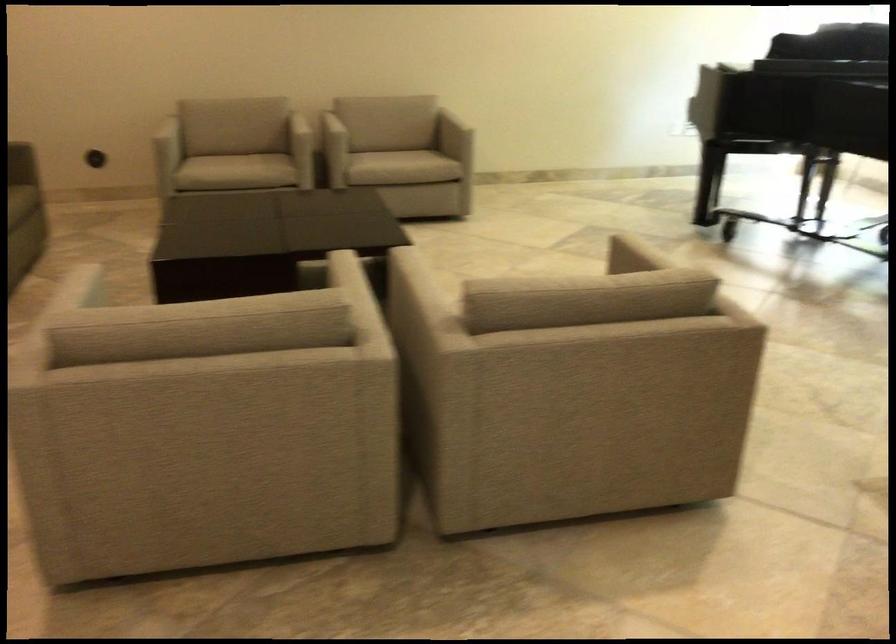
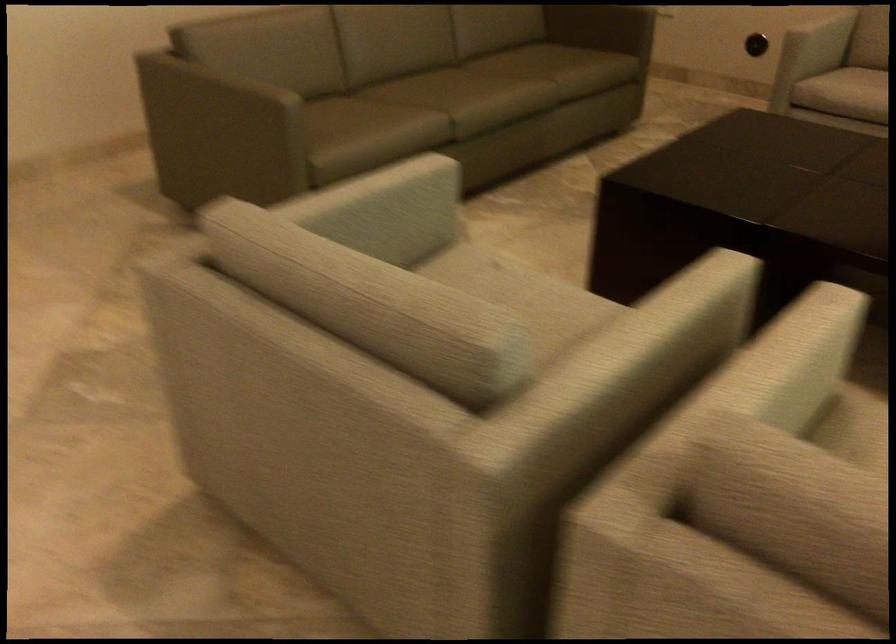
The point at (x=420, y=278) is marked in the first image. Where is the corresponding point in the second image?

(782, 366)